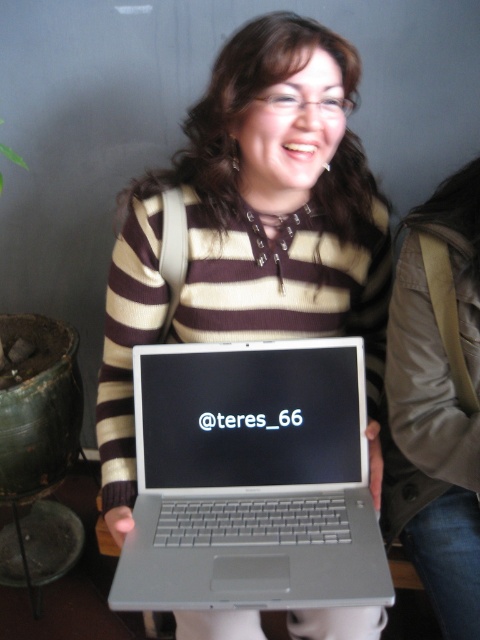
You are a photographer setting up for a portrait shoot. You need to ensure that the matte silver laptop at center is clearly visible in the photo. Based on the scene description, what is the minimum focal length you should use if your camera has a sensor size of 36mm and you want the laptop to occupy at least 20mm of the sensor height?

The matte silver laptop at center is 31.66 inches from the camera. To calculate the minimum focal length required, we can use the formula focal length > sensor size x object distance. However, since the question specifies a sensor size of 36mm and the laptop needs to occupy at least 20mm of the sensor height, the minimum focal length would be approximately 36mm x 31.66 inches divided by 20mm. But this might not be accurate without knowing the actual dimensions of the laptop. Since the exact size of the mat

You are trying to determine which laptop is the correct one to use for your work. The scene shows two laptops at the center, both labeled as silver. How can you distinguish between the matte silver laptop at center and the silver metallic laptop at center based on their appearance?

The matte silver laptop at center is taller than the silver metallic laptop at center, so you can identify the taller one as the matte silver laptop.